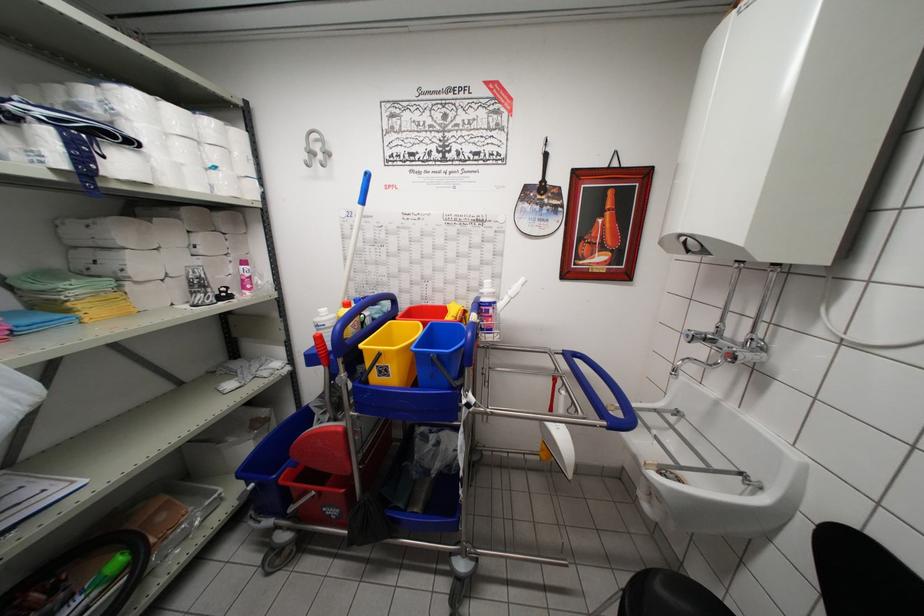
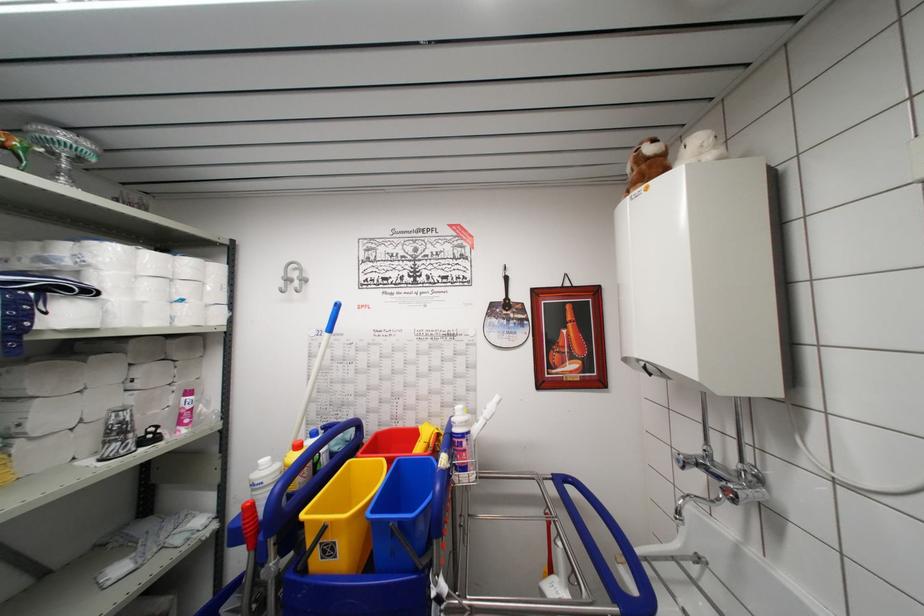
The point at (242,182) is marked in the first image. Where is the corresponding point in the second image?

(211, 310)